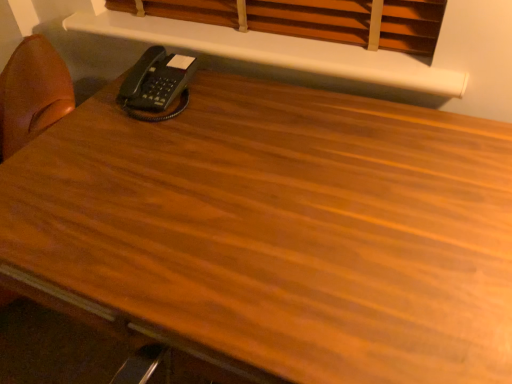
In order to click on unoccupied region to the right of black plastic phone at upper left in this screenshot , I will do `click(227, 94)`.